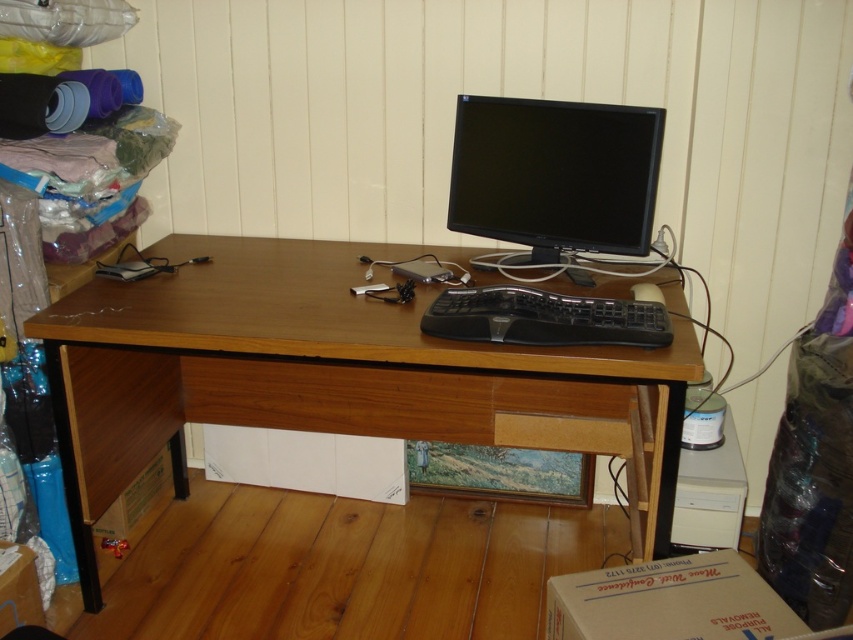
You are organizing your home office and need to place a new item on the wooden drawer at center or the white cardboard box at lower right. Which surface is closer to you?

The wooden drawer at center is closer to you than the white cardboard box at lower right, so you should place the item on the wooden drawer at center.

Consider the image. You are organizing your home office and need to place a new item on the wooden drawer at center. To ensure accuracy, what are the coordinates where you should place the item?

The wooden drawer at center is located at coordinates point (x=409, y=403), so you should place the new item there.

You are organizing your desk and want to place a new item between the cardboard box at lower left and the black plastic mouse at center. Is there enough vertical space between them to fit a 10 cm tall item?

The cardboard box at lower left is below the black plastic mouse at center, so there is sufficient vertical space between them to fit a 10 cm tall item.